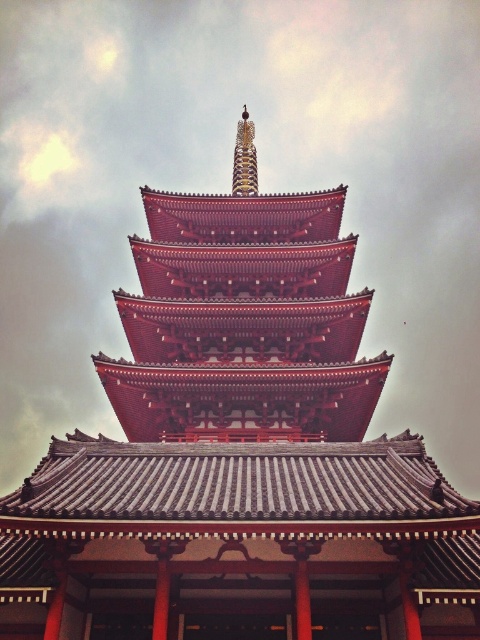
You are standing in front of the shiny red pagoda at center and the gold textured spire at upper center. Which object is located to the left of the other?

The gold textured spire at upper center is located to the left of the shiny red pagoda at center.

You are standing at point A located at coordinates point A at (294, 340). You want to walk to point B, which is 114.34 feet away from you. Is there a direct path between point A and point B without any obstacles?

Yes, there is a direct path between point A and point B since the pagoda structure does not block the line of sight between them, and the distance is 114.34 feet.

You are an architect analyzing the traditional pagoda. Based on the scene, which object is shorter in height between the shiny red pagoda at center and the gold textured spire at upper center?

The shiny red pagoda at center is shorter in height compared to the gold textured spire at upper center.